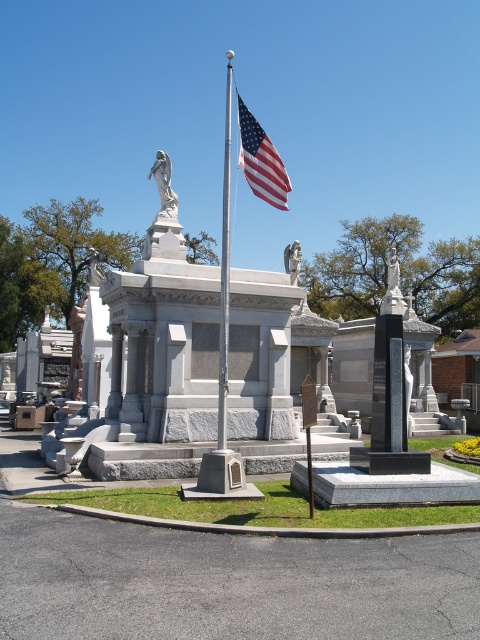
You are a drone operator instructed to capture aerial footage of the american flag at center in the cemetery scene. The drone must maintain a minimum altitude of 10 meters to avoid disturbing the peace. Given the flag is at coordinates 0.252, 0.544, can you confirm if the drone can safely hover above it without violating the altitude restriction?

The american flag at center is located at coordinates (x=261, y=161). Since the drone must maintain a minimum altitude of 10 meters, it can safely hover above the flag as long as it stays at or above that height, which does not violate the altitude restriction.

Looking at this image, you are a visitor at the cemetery and want to take a photo of the polished metal flagpole at center and the white marble statue at center. Based on their positions, which object should you place on the left side of your photo frame?

You should place the polished metal flagpole at center on the left side of your photo frame because it is positioned to the left of the white marble statue at center.